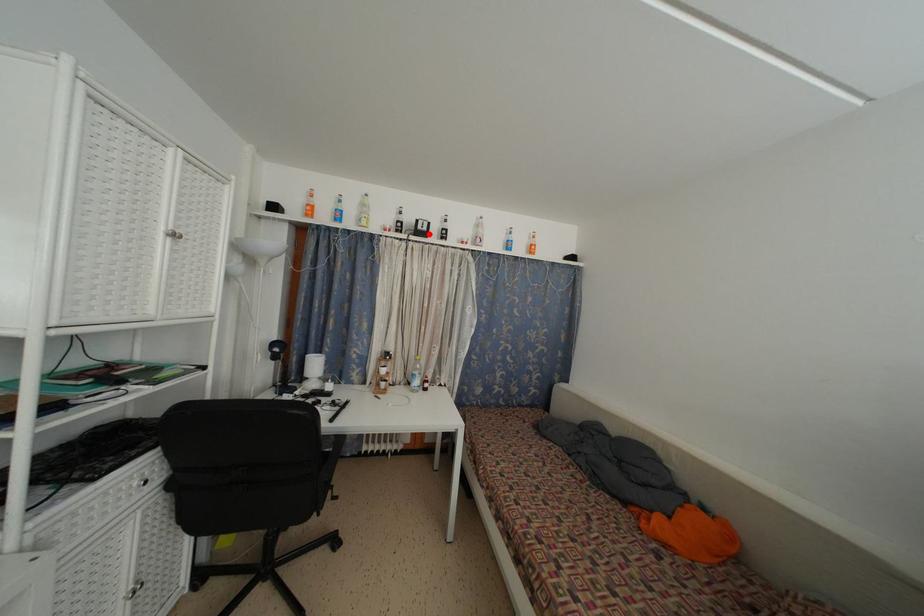
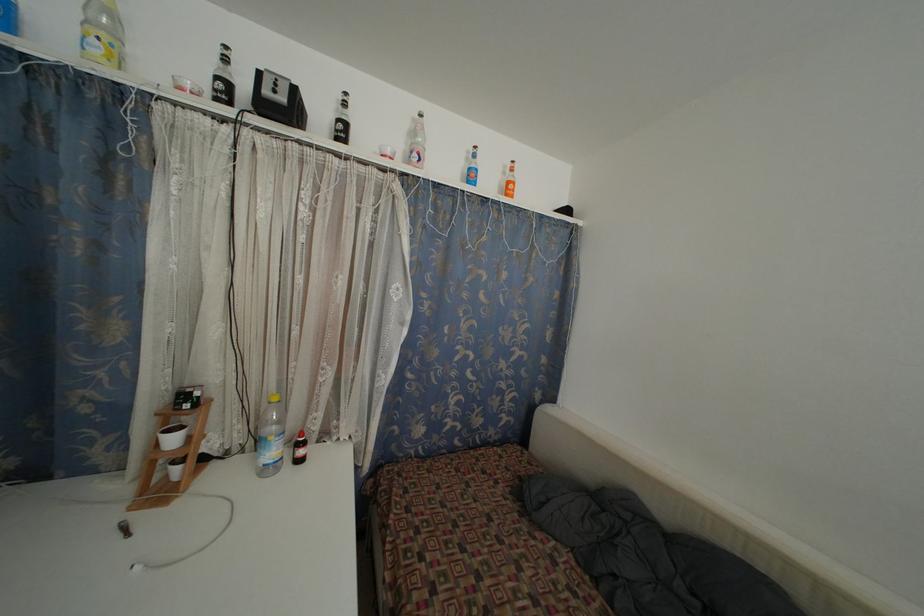
In the second image, find the point that corresponds to the highlighted location in the first image.

(286, 105)